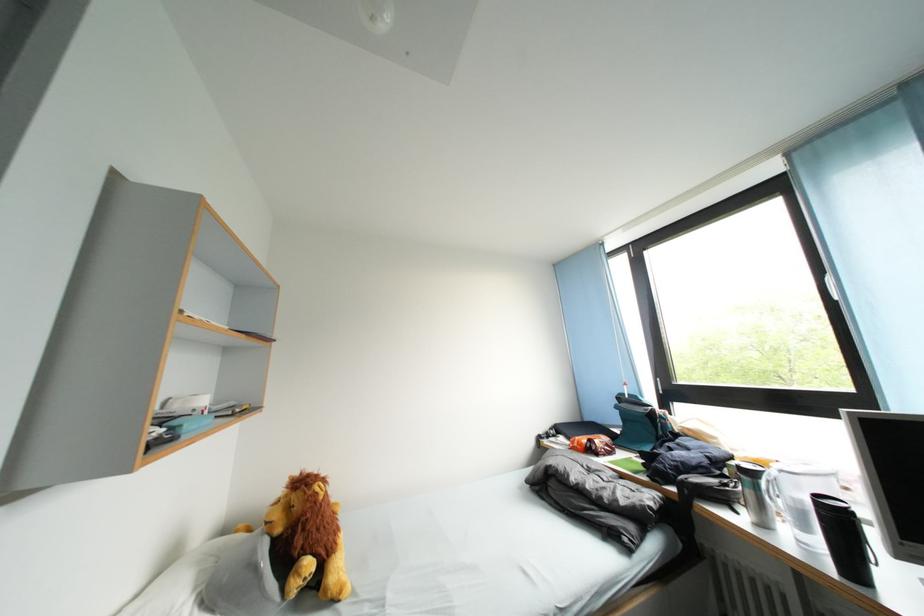
What do you see at coordinates (853, 286) in the screenshot?
I see `a white window handle` at bounding box center [853, 286].